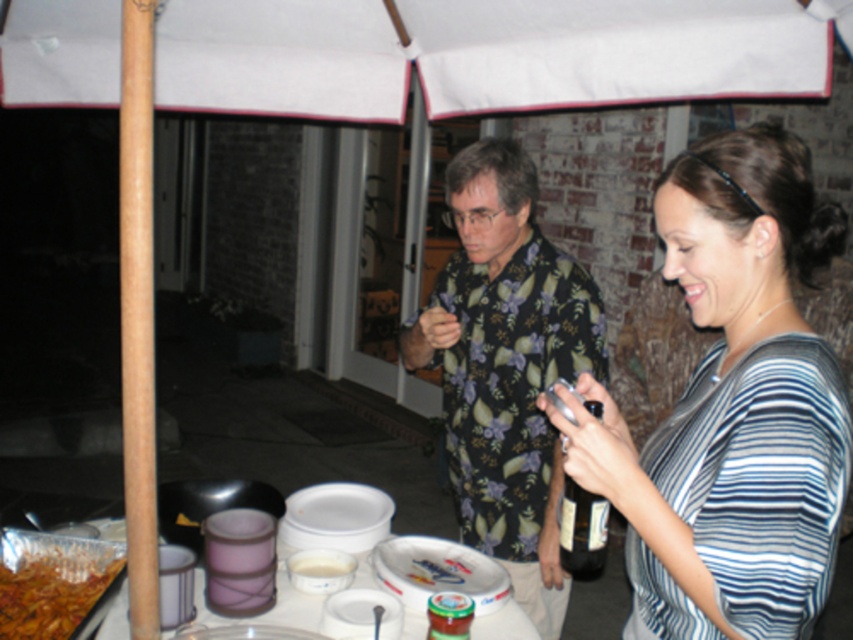
Consider the image. You are a photographer trying to capture a candid shot of the striped fabric shirt at center and the shiny aluminum foil at lower left. Based on their positions, which object should you focus on first to ensure both are in the frame without moving the camera?

The striped fabric shirt at center is taller than the shiny aluminum foil at lower left, so you should focus on the striped fabric shirt at center first to ensure both are in the frame without moving the camera.